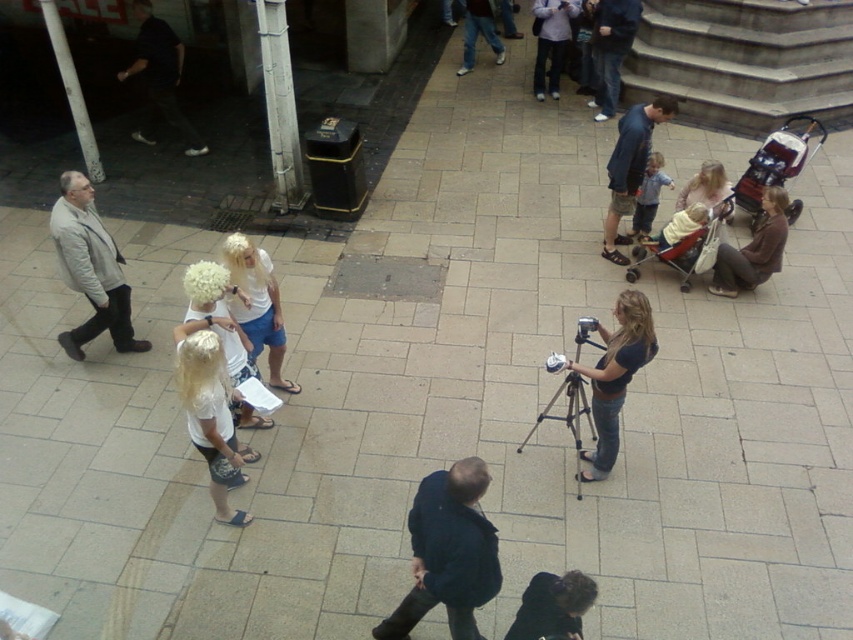
Question: Among these points, which one is nearest to the camera?

Choices:
 (A) (279, 316)
 (B) (97, 161)
 (C) (630, 266)
 (D) (683, 188)

Answer: (A)

Question: Which point is closer to the camera?

Choices:
 (A) (221, 484)
 (B) (709, 170)

Answer: (A)

Question: Which of the following is the closest to the observer?

Choices:
 (A) (694, 240)
 (B) (727, 189)
 (C) (277, 177)
 (D) (142, 140)

Answer: (A)

Question: Is metallic tripod at center in front of denim jacket at center?

Choices:
 (A) no
 (B) yes

Answer: (B)

Question: Does light gray jacket at left come in front of metallic tripod at center?

Choices:
 (A) yes
 (B) no

Answer: (B)

Question: Is matte yellow baby carriage at center wider than blonde hair at center?

Choices:
 (A) yes
 (B) no

Answer: (A)